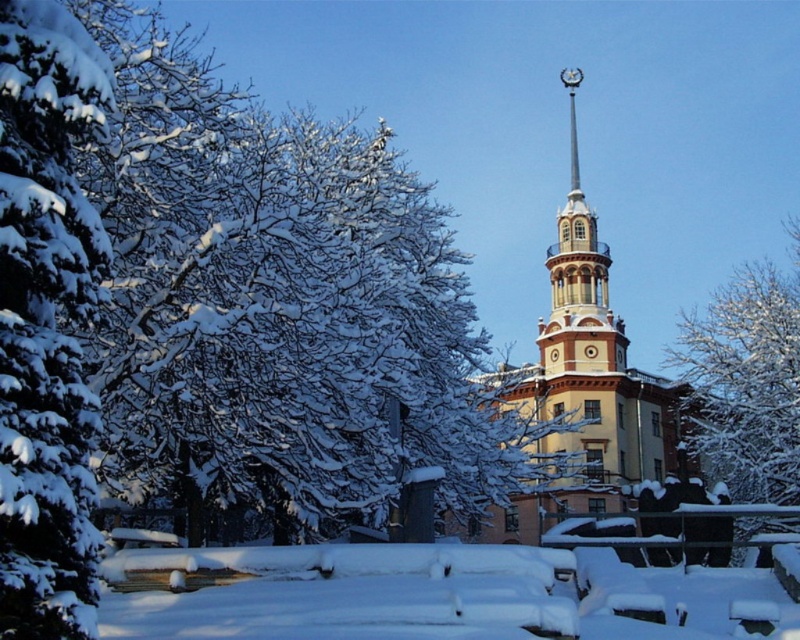
Is yellow painted wood tower at center above white snow-covered tree at center?

Yes, yellow painted wood tower at center is above white snow-covered tree at center.

Between point (578, 369) and point (766, 394), which one is positioned in front?

Point (578, 369)

Is point (666, 435) positioned in front of point (730, 320)?

No.

Locate an element on the screen. yellow painted wood tower at center is located at coordinates (588, 376).

Can you confirm if white fluffy snow at left is positioned below white snow-covered tree at center?

Incorrect, white fluffy snow at left is not positioned below white snow-covered tree at center.

Which is below, white fluffy snow at left or white snow-covered tree at center?

white snow-covered tree at center is lower down.

Is point (52, 500) behind point (778, 390)?

No, it is not.

Identify the location of white fluffy snow at left. This screenshot has width=800, height=640. [x=48, y=321].

Locate an element on the screen. The image size is (800, 640). white fluffy snow at left is located at coordinates (48, 321).

Between white fluffy snow at left and yellow painted wood tower at center, which one is positioned lower?

white fluffy snow at left is lower down.

Which is in front, point (62, 131) or point (604, 442)?

Point (62, 131) is more forward.

This screenshot has height=640, width=800. I want to click on white fluffy snow at left, so click(x=48, y=321).